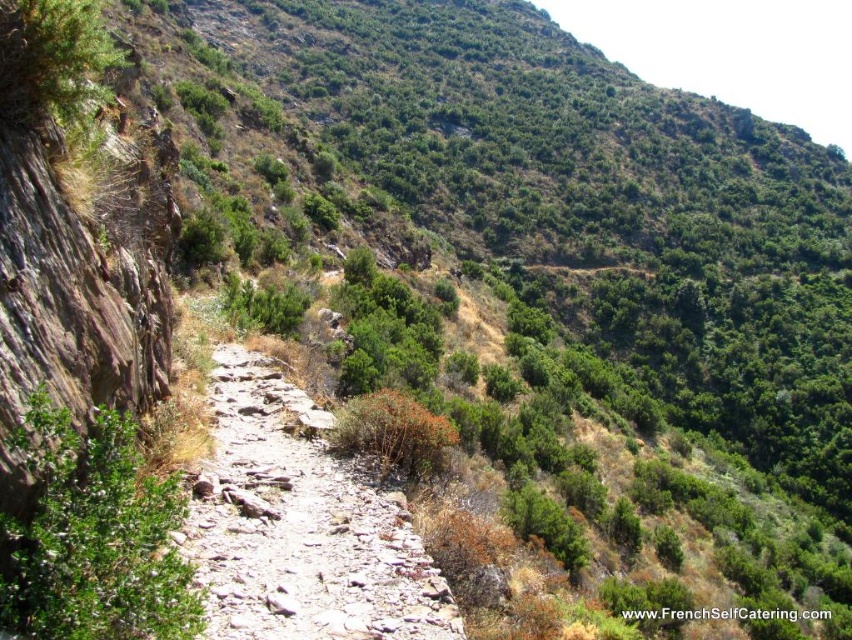
Which is above, dusty stone path at center or green leafy bush at center?

green leafy bush at center is above.

Which is more to the left, dusty stone path at center or green leafy bush at center?

green leafy bush at center

Who is more distant from viewer, (233, 442) or (199, 624)?

Point (233, 442)

Where is `dusty stone path at center`? The width and height of the screenshot is (852, 640). dusty stone path at center is located at coordinates (300, 525).